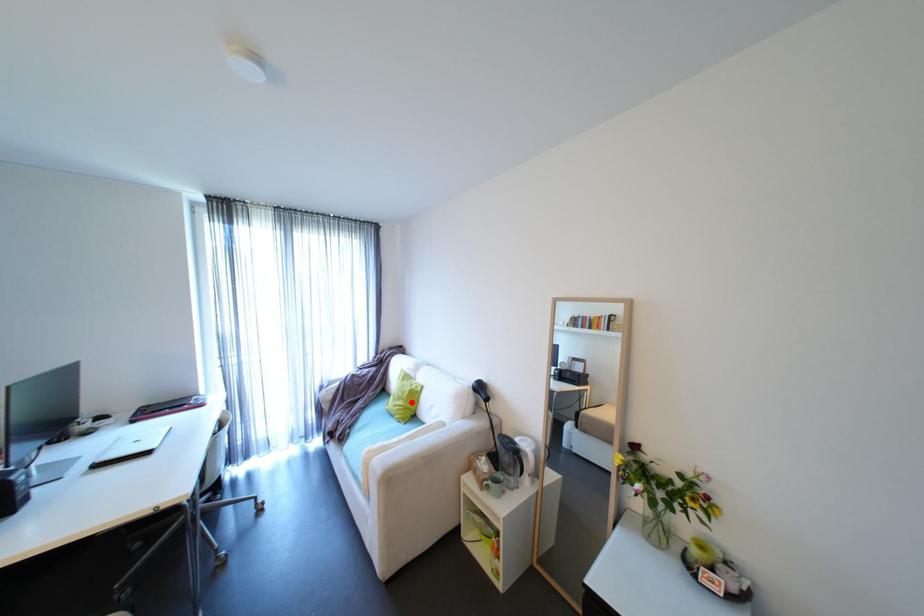
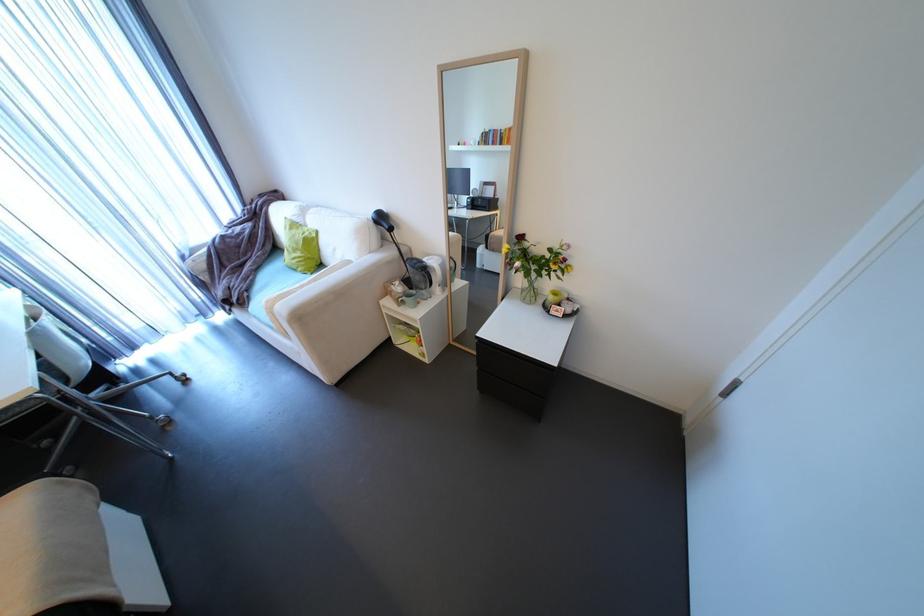
Question: I am providing you with two images of the same scene from different viewpoints. In image1, a red point is highlighted. Considering the same 3D point in image2, which of the following is correct?

Choices:
 (A) It is closer
 (B) It is farther

Answer: (A)